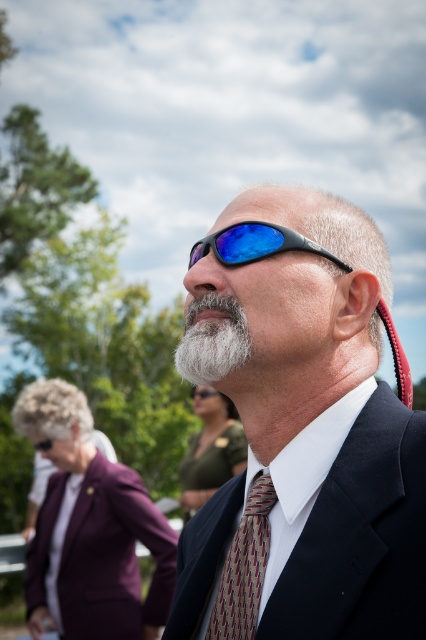
Is matte black suit at center to the right of multicolored woven tie at center from the viewer's perspective?

Correct, you'll find matte black suit at center to the right of multicolored woven tie at center.

Does matte black suit at center have a lesser height compared to multicolored woven tie at center?

Incorrect, matte black suit at center's height does not fall short of multicolored woven tie at center's.

Does point (221, 316) come closer to viewer compared to point (256, 538)?

No, it is behind (256, 538).

Where is `matte black suit at center`? The image size is (426, 640). matte black suit at center is located at coordinates (301, 433).

At what (x,y) coordinates should I click in order to perform the action: click on white fuzzy beard at center. Please return your answer as a coordinate pair (x, y). Looking at the image, I should click on (213, 339).

Looking at this image, which is below, white fuzzy beard at center or blue reflective plastic goggles at center?

white fuzzy beard at center is lower down.

Which is behind, point (184, 348) or point (213, 243)?

Point (213, 243)

Where is `white fuzzy beard at center`? Image resolution: width=426 pixels, height=640 pixels. white fuzzy beard at center is located at coordinates (213, 339).

In the scene shown: Can you confirm if matte black suit at center is wider than white fuzzy beard at center?

Correct, the width of matte black suit at center exceeds that of white fuzzy beard at center.

Can you confirm if matte black suit at center is positioned to the left of white fuzzy beard at center?

No, matte black suit at center is not to the left of white fuzzy beard at center.

Describe the element at coordinates (301, 433) in the screenshot. I see `matte black suit at center` at that location.

The image size is (426, 640). Find the location of `matte black suit at center`. matte black suit at center is located at coordinates (301, 433).